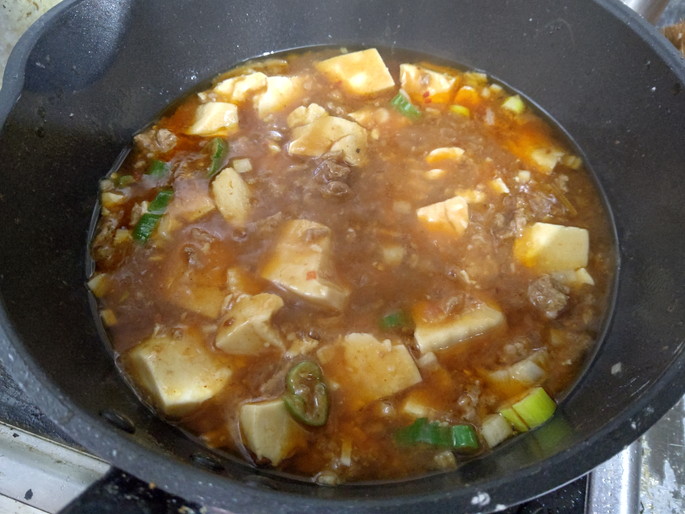
Find the location of `bowl`. bowl is located at coordinates click(x=658, y=328).